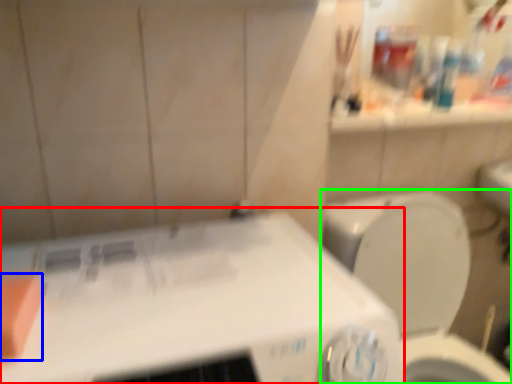
Question: Considering the real-world distances, which object is farthest from appliance (highlighted by a red box)? soap (highlighted by a blue box) or toilet (highlighted by a green box)?

Choices:
 (A) soap
 (B) toilet

Answer: (B)